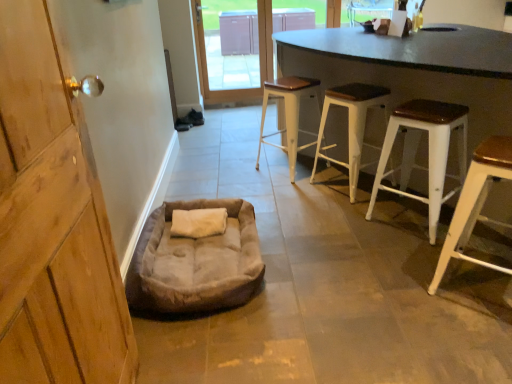
Question: Considering the positions of white metal stool at center, placed as the 4th stool when sorted from front to back, and transparent glass door at upper center in the image, is white metal stool at center, placed as the 4th stool when sorted from front to back, bigger or smaller than transparent glass door at upper center?

Choices:
 (A) big
 (B) small

Answer: (B)

Question: Is white metal stool at center, placed as the 4th stool when sorted from front to back, in front of or behind transparent glass door at upper center in the image?

Choices:
 (A) behind
 (B) front

Answer: (B)

Question: Which object is positioned farthest from the suede-like beige dog bed at lower left?

Choices:
 (A) white metal stool at center, the 1th stool viewed from the back
 (B) white metal stool at right, the 2th stool positioned from the front
 (C) white wood stool at center, which is counted as the third stool, starting from the front
 (D) transparent glass door at upper center
 (E) wooden door handle at left

Answer: (D)

Question: Which object is positioned farthest from the white wood stool at right, placed as the 1th stool when sorted from front to back?

Choices:
 (A) white metal stool at center, the 1th stool viewed from the back
 (B) white metal stool at right, which is the 3th stool from back to front
 (C) suede-like beige dog bed at lower left
 (D) black matte table at center
 (E) transparent glass door at upper center

Answer: (E)